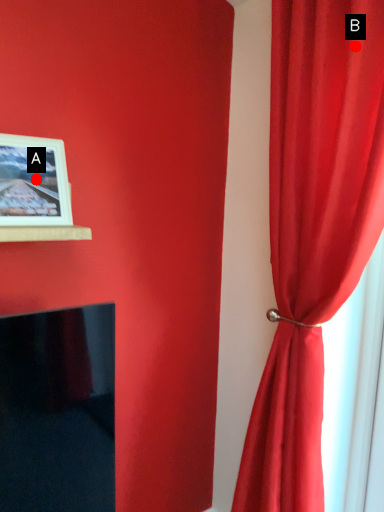
Question: Two points are circled on the image, labeled by A and B beside each circle. Which of the following is the closest to the observer?

Choices:
 (A) A is closer
 (B) B is closer

Answer: (B)